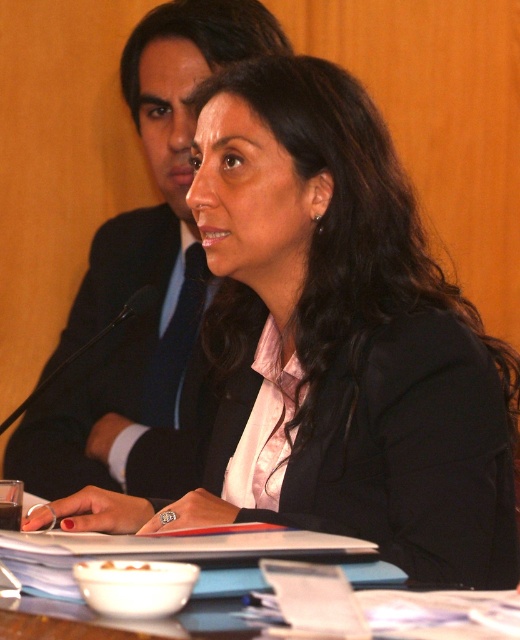
Is point (101, 234) closer to camera compared to point (65, 608)?

No, it is behind (65, 608).

What do you see at coordinates (97, 356) in the screenshot? I see `black matte suit at upper center` at bounding box center [97, 356].

At what (x,y) coordinates should I click in order to perform the action: click on black matte suit at upper center. Please return your answer as a coordinate pair (x, y). Looking at the image, I should click on point(97,356).